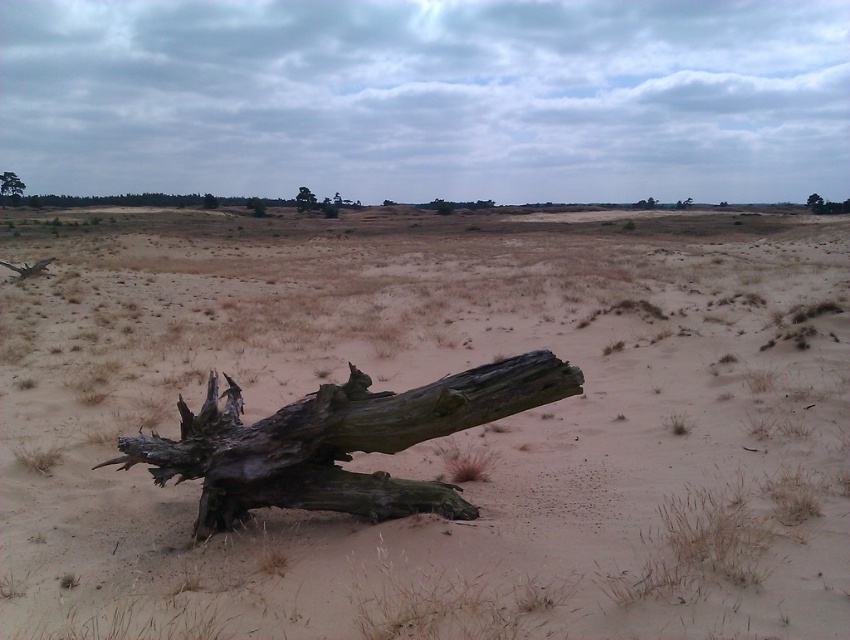
You are standing at the center of the image and want to place a small marker at the exact center of the dark brown wood at center. What are the coordinates where you should place the marker?

The coordinates for the exact center of the dark brown wood at center are at point (338, 442).

In the scene shown: You are a hiker navigating through this desert landscape. You see the dark brown wood at center and the green rough bark tree at upper left. Which object is closer to you?

The dark brown wood at center is closer to you because it is positioned in front of the green rough bark tree at upper left.

You are a hiker trying to navigate through this desert landscape. You see the green rough bark tree at upper left and the dark brown wood at upper center. Which object would you choose as a landmark for navigation, and why?

The green rough bark tree at upper left would be a better landmark because it is larger in size compared to the dark brown wood at upper center, making it more visible from a distance.